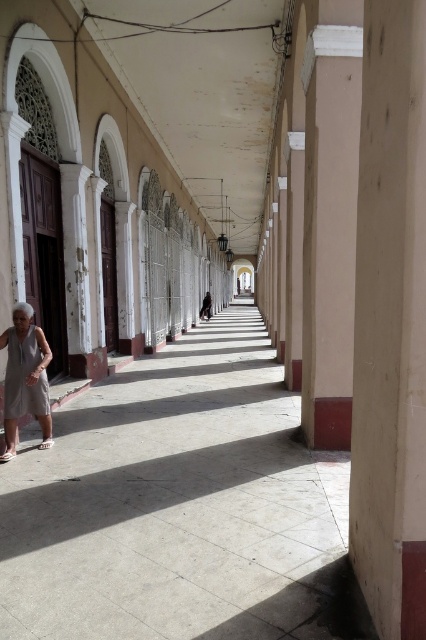
Which is behind, point (396, 225) or point (43, 348)?

Positioned behind is point (43, 348).

Who is more forward, (414, 221) or (16, 340)?

Point (414, 221) is more forward.

Identify the location of smooth concrete pillar at center. (391, 323).